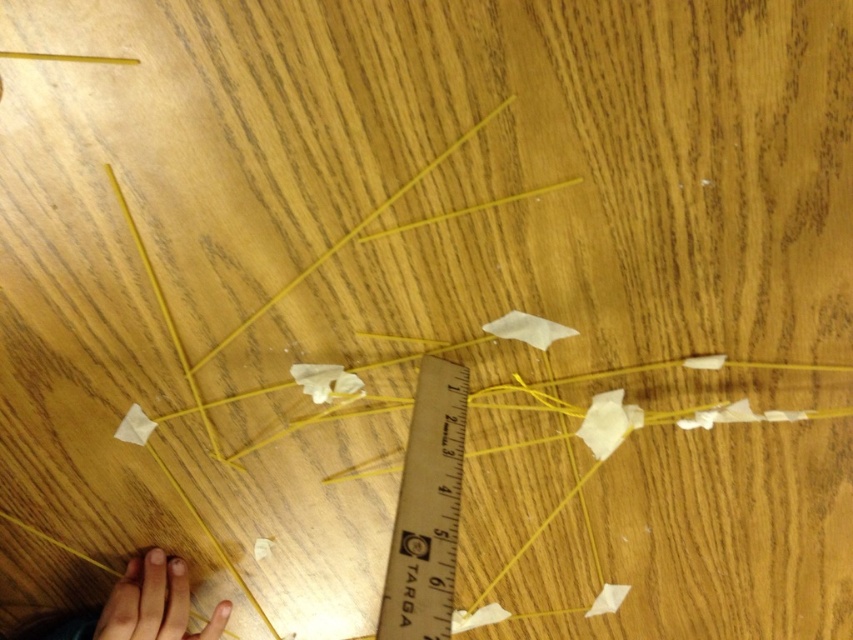
Question: Does wooden ruler at center have a greater width compared to smooth skin hand at lower left?

Choices:
 (A) yes
 (B) no

Answer: (B)

Question: Is wooden ruler at center thinner than smooth skin hand at lower left?

Choices:
 (A) yes
 (B) no

Answer: (A)

Question: Is wooden ruler at center below smooth skin hand at lower left?

Choices:
 (A) no
 (B) yes

Answer: (A)

Question: Which object appears closest to the camera in this image?

Choices:
 (A) wooden ruler at center
 (B) smooth skin hand at lower left

Answer: (A)

Question: Among these objects, which one is nearest to the camera?

Choices:
 (A) smooth skin hand at lower left
 (B) wooden ruler at center

Answer: (B)